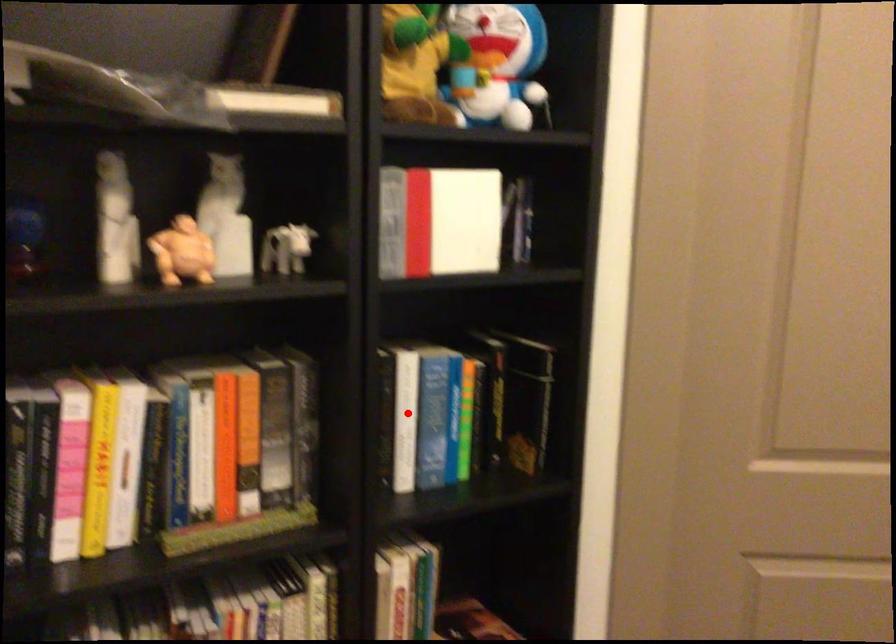
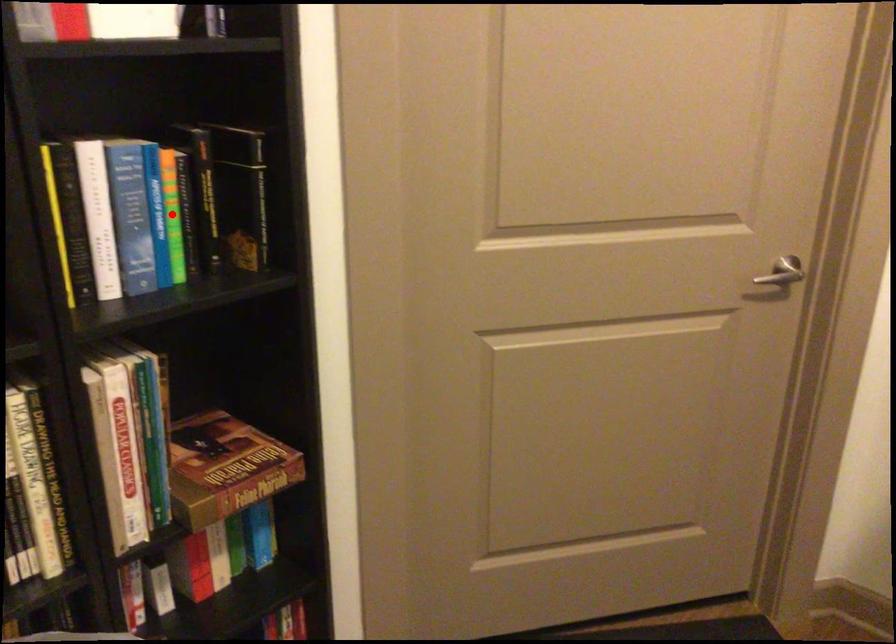
I am providing you with two images of the same scene from different viewpoints. A red point is marked on the first image and another point is marked on the second image. Is the marked point in image1 the same physical position as the marked point in image2?

No